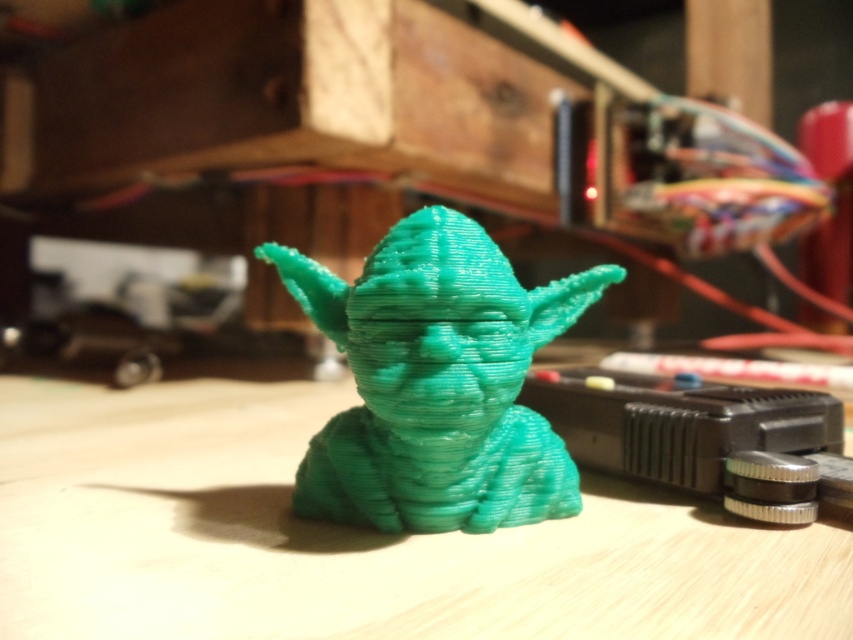
Based on the photo, you are an engineer working in a workshop. You need to locate the green matte plastic yoda at center. According to the coordinates provided, where exactly is it positioned?

The green matte plastic yoda at center is located at point coordinates of (350, 536).

You are an artist trying to place a small sticker on the Yoda figurine. You have two points to choose from on the figurine marked as point [341,561] and point [370,524]. Which point is closer to you so that the sticker is more visible?

Point [341,561] is closer to the viewer than point [370,524], so placing the sticker there would make it more visible.

You are organizing a display for a Star Wars convention and have two Yoda figurines to place side by side. The green matte plastic yoda at center and the teal matte yoda head at center. Which one is wider?

The green matte plastic yoda at center is wider than the teal matte yoda head at center.